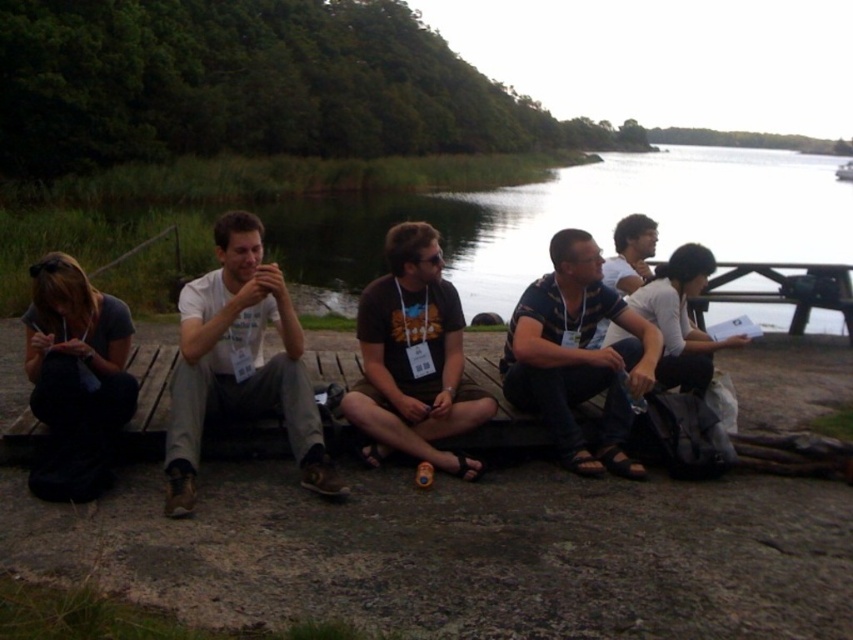
Question: Which point is farther to the camera?

Choices:
 (A) white matte shirt at center
 (B) brown cotton t-shirt at center
 (C) striped cotton shirt at center

Answer: (C)

Question: Can you confirm if brown cotton t-shirt at center is thinner than striped cotton shirt at center?

Choices:
 (A) no
 (B) yes

Answer: (B)

Question: Is brown cotton t-shirt at center thinner than striped cotton shirt at center?

Choices:
 (A) yes
 (B) no

Answer: (A)

Question: Which of the following is the closest to the observer?

Choices:
 (A) brown cotton t-shirt at center
 (B) white matte shirt at center

Answer: (B)

Question: Estimate the real-world distances between objects in this image. Which object is farther from the striped cotton shirt at center?

Choices:
 (A) white matte shirt at center
 (B) brown cotton t-shirt at center

Answer: (A)

Question: Is white matte shirt at center bigger than brown cotton t-shirt at center?

Choices:
 (A) yes
 (B) no

Answer: (A)